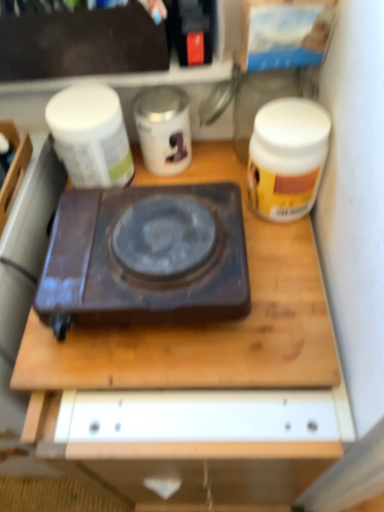
At what (x,y) coordinates should I click in order to perform the action: click on matte black box at upper left. Please return your answer as a coordinate pair (x, y). Looking at the image, I should click on (81, 44).

Locate an element on the screen. white glossy canister at center, the second yoghurt positioned from the left is located at coordinates (163, 129).

Based on the photo, measure the distance between white glossy canister at center, the 1th yoghurt positioned from the right, and camera.

The depth of white glossy canister at center, the 1th yoghurt positioned from the right, is 28.99 inches.

What do you see at coordinates (91, 135) in the screenshot?
I see `white matte jar at upper left, the first yoghurt when ordered from left to right` at bounding box center [91, 135].

The height and width of the screenshot is (512, 384). I want to click on white matte jar at upper left, the first yoghurt when ordered from left to right, so click(91, 135).

I want to click on yellow matte jar at right, so click(287, 157).

Measure the distance between point (101, 399) and camera.

The depth of point (101, 399) is 23.54 inches.

Image resolution: width=384 pixels, height=512 pixels. Find the location of `wooden desk at center`. wooden desk at center is located at coordinates (201, 369).

This screenshot has height=512, width=384. Identify the location of matte black box at upper left. (81, 44).

In the scene shown: Is dark brown plastic gas stove at center closer to the viewer compared to transparent glass jar at upper center?

That is True.

Looking at this image, is dark brown plastic gas stove at center facing away from transparent glass jar at upper center?

Correct, dark brown plastic gas stove at center is looking away from transparent glass jar at upper center.

Is dark brown plastic gas stove at center positioned beyond the bounds of transparent glass jar at upper center?

Yes, dark brown plastic gas stove at center is outside of transparent glass jar at upper center.

Is yellow matte jar at right closer to the viewer compared to dark brown plastic gas stove at center?

No, it is behind dark brown plastic gas stove at center.

Looking at this image, which point is more distant from viewer, [275,139] or [53,260]?

Point [275,139]

Which is more to the left, yellow matte jar at right or dark brown plastic gas stove at center?

dark brown plastic gas stove at center is more to the left.

Is dark brown plastic gas stove at center a part of yellow matte jar at right?

No, dark brown plastic gas stove at center is located outside of yellow matte jar at right.

Are white glossy canister at center, the second yoghurt positioned from the left, and matte black box at upper left far apart?

That's not correct — white glossy canister at center, the second yoghurt positioned from the left, is a little close to matte black box at upper left.

Is matte black box at upper left at the back of white glossy canister at center, the second yoghurt positioned from the left?

That's not correct — white glossy canister at center, the second yoghurt positioned from the left, is not looking away from matte black box at upper left.

In terms of height, does white glossy canister at center, the 1th yoghurt positioned from the right, look taller or shorter compared to matte black box at upper left?

Clearly, white glossy canister at center, the 1th yoghurt positioned from the right, is taller compared to matte black box at upper left.

From a real-world perspective, which is physically above, white glossy canister at center, the 1th yoghurt positioned from the right, or matte black box at upper left?

matte black box at upper left.

From the image's perspective, is transparent glass jar at upper center positioned above or below dark brown plastic gas stove at center?

Clearly, from the image's perspective, transparent glass jar at upper center is above dark brown plastic gas stove at center.

Are transparent glass jar at upper center and dark brown plastic gas stove at center located far from each other?

transparent glass jar at upper center is near dark brown plastic gas stove at center, not far away.

In the scene shown: In terms of width, does transparent glass jar at upper center look wider or thinner when compared to dark brown plastic gas stove at center?

Clearly, transparent glass jar at upper center has less width compared to dark brown plastic gas stove at center.

Consider the image. Considering the positions of objects transparent glass jar at upper center and dark brown plastic gas stove at center in the image provided, who is more to the left, transparent glass jar at upper center or dark brown plastic gas stove at center?

From the viewer's perspective, dark brown plastic gas stove at center appears more on the left side.

Looking at their sizes, would you say yellow matte jar at right is wider or thinner than matte black box at upper left?

yellow matte jar at right is thinner than matte black box at upper left.

From a real-world perspective, is yellow matte jar at right below matte black box at upper left?

Indeed, from a real-world perspective, yellow matte jar at right is positioned beneath matte black box at upper left.

Is yellow matte jar at right far from matte black box at upper left?

yellow matte jar at right is near matte black box at upper left, not far away.

Could matte black box at upper left be considered to be inside yellow matte jar at right?

No, yellow matte jar at right does not contain matte black box at upper left.

Is white glossy canister at center, the second yoghurt positioned from the left, facing towards dark brown plastic gas stove at center?

Yes, white glossy canister at center, the second yoghurt positioned from the left, faces towards dark brown plastic gas stove at center.

Is white glossy canister at center, the 1th yoghurt positioned from the right, positioned beyond the bounds of dark brown plastic gas stove at center?

Yes.

Does point (160, 114) lie in front of point (208, 283)?

No, it is not.

Looking at this image, between white glossy canister at center, the 1th yoghurt positioned from the right, and dark brown plastic gas stove at center, which one appears on the right side from the viewer's perspective?

white glossy canister at center, the 1th yoghurt positioned from the right, is more to the right.

Based on the photo, considering the relative sizes of dark brown plastic gas stove at center and matte black box at upper left in the image provided, is dark brown plastic gas stove at center smaller than matte black box at upper left?

Incorrect, dark brown plastic gas stove at center is not smaller in size than matte black box at upper left.

Is dark brown plastic gas stove at center far from matte black box at upper left?

No, dark brown plastic gas stove at center is not far from matte black box at upper left.

In the scene shown: From their relative heights in the image, would you say dark brown plastic gas stove at center is taller or shorter than matte black box at upper left?

Clearly, dark brown plastic gas stove at center is shorter compared to matte black box at upper left.

Locate an element on the screen. This screenshot has width=384, height=512. gas stove below the transparent glass jar at upper center (from the image's perspective) is located at coordinates (145, 256).

What are the coordinates of `gas stove lying on the left of yellow matte jar at right` in the screenshot? It's located at (145, 256).

Based on their spatial positions, is white matte jar at upper left, the first yoghurt when ordered from left to right, or wooden desk at center closer to transparent glass jar at upper center?

Based on the image, white matte jar at upper left, the first yoghurt when ordered from left to right, appears to be nearer to transparent glass jar at upper center.

Considering their positions, is white glossy canister at center, the 1th yoghurt positioned from the right, positioned further to dark brown plastic gas stove at center than yellow matte jar at right?

white glossy canister at center, the 1th yoghurt positioned from the right.

In the scene shown: From the image, which object appears to be farther from dark brown plastic gas stove at center, matte black box at upper left or yellow matte jar at right?

matte black box at upper left lies further to dark brown plastic gas stove at center than the other object.

From the image, which object appears to be nearer to white glossy canister at center, the second yoghurt positioned from the left, wooden desk at center or dark brown plastic gas stove at center?

dark brown plastic gas stove at center.

Estimate the real-world distances between objects in this image. Which object is further from white glossy canister at center, the 1th yoghurt positioned from the right, transparent glass jar at upper center or dark brown plastic gas stove at center?

dark brown plastic gas stove at center is positioned further to the anchor white glossy canister at center, the 1th yoghurt positioned from the right.

Looking at the image, which one is located closer to matte black box at upper left, dark brown plastic gas stove at center or wooden desk at center?

dark brown plastic gas stove at center.

Which object lies further to the anchor point white matte jar at upper left, the first yoghurt when ordered from left to right, matte black box at upper left or wooden desk at center?

wooden desk at center.

From the image, which object appears to be farther from white glossy canister at center, the 1th yoghurt positioned from the right, yellow matte jar at right or matte black box at upper left?

yellow matte jar at right is further to white glossy canister at center, the 1th yoghurt positioned from the right.

I want to click on glass jar between matte black box at upper left and wooden desk at center from top to bottom, so click(x=267, y=98).

The width and height of the screenshot is (384, 512). What are the coordinates of `glass jar between white glossy canister at center, the second yoghurt positioned from the left, and yellow matte jar at right, in the horizontal direction` in the screenshot? It's located at (267, 98).

Where is `kitchen appliance that lies between transparent glass jar at upper center and dark brown plastic gas stove at center from top to bottom`? Image resolution: width=384 pixels, height=512 pixels. kitchen appliance that lies between transparent glass jar at upper center and dark brown plastic gas stove at center from top to bottom is located at coordinates (287, 157).

The image size is (384, 512). Identify the location of yoghurt between white matte jar at upper left, the first yoghurt when ordered from left to right, and transparent glass jar at upper center from left to right. (163, 129).